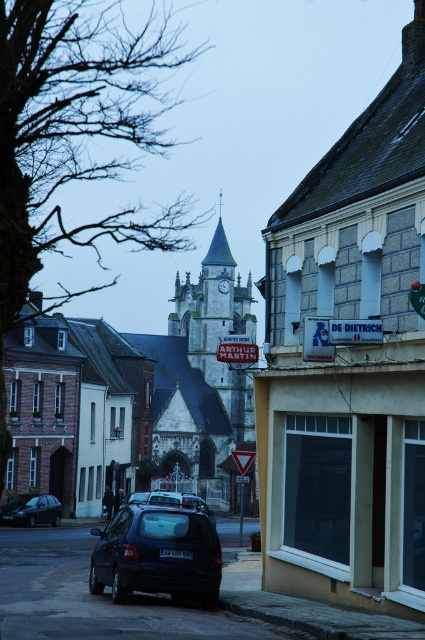
Between point (153, 500) and point (221, 282), which one is positioned in front?

Point (153, 500) is more forward.

Where is `dark gray matte car at center`? dark gray matte car at center is located at coordinates (167, 499).

Is stone clock tower at center to the right of metallic gray clock at center from the viewer's perspective?

Indeed, stone clock tower at center is positioned on the right side of metallic gray clock at center.

Is stone clock tower at center shorter than metallic gray clock at center?

No, stone clock tower at center is not shorter than metallic gray clock at center.

What do you see at coordinates (218, 330) in the screenshot? I see `stone clock tower at center` at bounding box center [218, 330].

Locate an element on the screen. This screenshot has height=640, width=425. stone clock tower at center is located at coordinates (218, 330).

Between point (146, 536) and point (28, 516), which one is positioned in front?

Point (146, 536) is in front.

Is dark blue matte hatchback at center to the left of dark gray metallic car at lower left from the viewer's perspective?

Incorrect, dark blue matte hatchback at center is not on the left side of dark gray metallic car at lower left.

Is point (180, 563) in front of point (17, 520)?

Yes, point (180, 563) is closer to viewer.

Where is `dark blue matte hatchback at center`? This screenshot has width=425, height=640. dark blue matte hatchback at center is located at coordinates (158, 554).